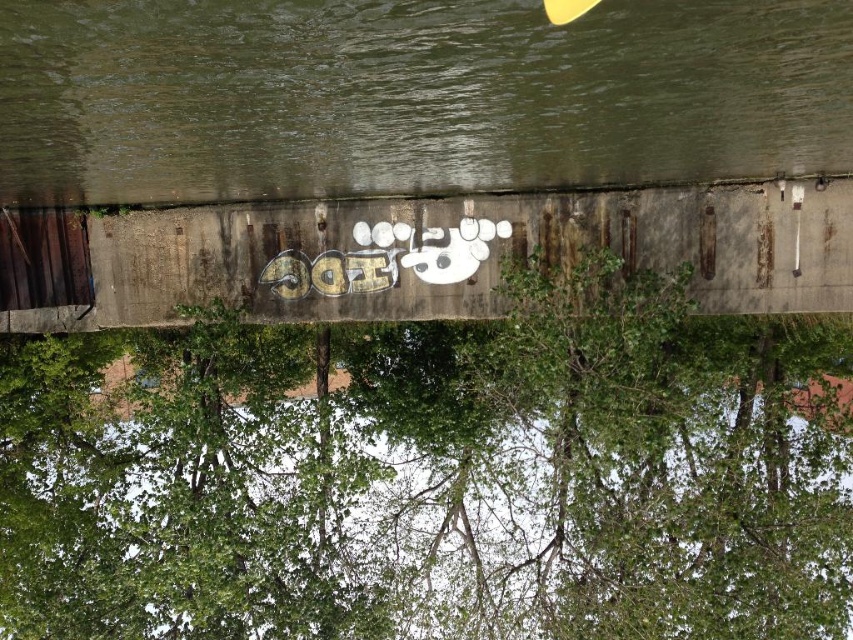
Between green leafy tree at center and green concrete river at center, which one has more height?

With more height is green leafy tree at center.

Can you confirm if green leafy tree at center is bigger than green concrete river at center?

Correct, green leafy tree at center is larger in size than green concrete river at center.

Is point (596, 518) farther from viewer compared to point (708, 157)?

Yes, point (596, 518) is behind point (708, 157).

Identify the location of green leafy tree at center. (431, 477).